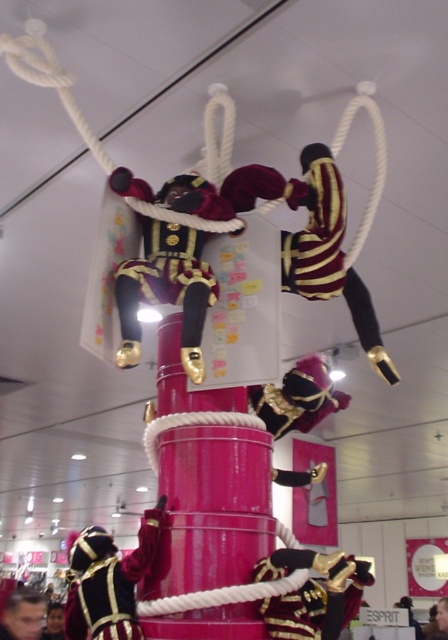
You are a stagehand measuring the space between the striped velvet pants at center and the velvet gold uniform at lower left. If the minimum required distance for safe passage is 3 feet, can you safely move a 1.5 feet wide equipment through the space between them?

The distance between the striped velvet pants at center and the velvet gold uniform at lower left is 3.55 feet. Since the equipment is 1.5 feet wide and the required minimum distance is 3 feet, the total needed space would be 3 feet. The available space is 3.55 feet, which is sufficient. Therefore, the equipment can safely pass through the space between them.

You are a spectator at the performance. You see the shiny gold uniform at center and the smooth skin face at lower left. Which one is positioned higher in the image?

The shiny gold uniform at center is located above the smooth skin face at lower left, so it is positioned higher in the image.

You are a photographer standing at the camera position. You want to take a closeup photo of the velvet gold uniform at lower left. Can you reach it without moving your position? The camera has a maximum zoom range of 1.5 meters.

The velvet gold uniform at lower left is 1.77 meters away from the camera, which exceeds the maximum zoom range of 1.5 meters. Therefore, you cannot take a closeup photo without moving closer.